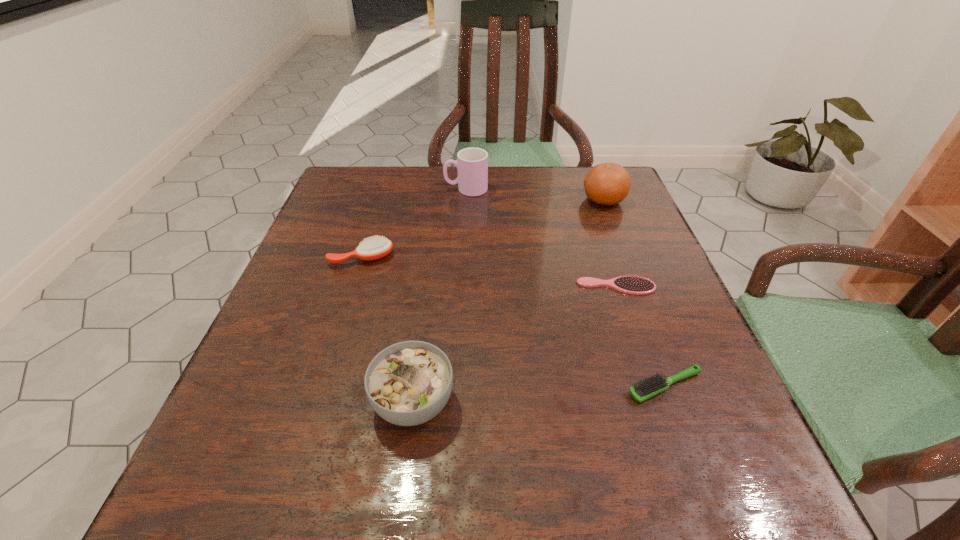
This screenshot has width=960, height=540. Find the location of `free space between the cup and the nearest hairbrush`. free space between the cup and the nearest hairbrush is located at coordinates (565, 287).

Locate an element on the screen. The height and width of the screenshot is (540, 960). vacant space that's between the shortest hairbrush and the cup is located at coordinates (541, 238).

Locate an element on the screen. unoccupied position between the fifth tallest object and the leftmost object is located at coordinates (514, 321).

Find the location of a particular element. free area in between the clementine and the fourth shortest object is located at coordinates [509, 301].

I want to click on vacant space in between the third tallest object and the second farthest hairbrush, so click(515, 344).

Identify the location of free area in between the shortest object and the clementine. This screenshot has width=960, height=540. (610, 243).

Locate an element on the screen. This screenshot has width=960, height=540. free space between the soup bowl and the second farthest hairbrush is located at coordinates (515, 344).

At what (x,y) coordinates should I click in order to perform the action: click on free area in between the fourth tallest object and the second tallest hairbrush. Please return your answer as a coordinate pair (x, y). Looking at the image, I should click on (514, 321).

I want to click on the fourth closest object to the clementine, so click(375, 248).

At what (x,y) coordinates should I click in order to perform the action: click on object that is the fifth closest to the tallest hairbrush. Please return your answer as a coordinate pair (x, y). Looking at the image, I should click on [654, 385].